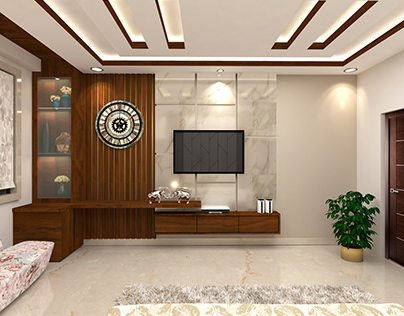
Where is `interior corner`? The height and width of the screenshot is (316, 404). interior corner is located at coordinates (356, 138).